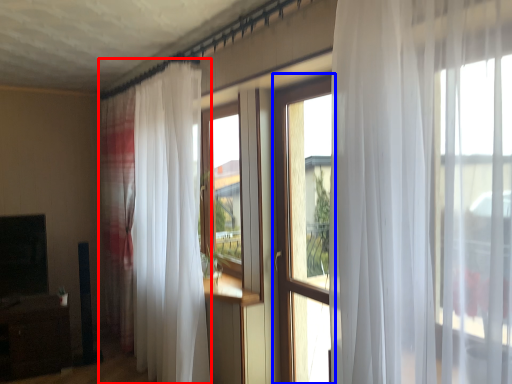
Question: Among these objects, which one is farthest to the camera, curtain (highlighted by a red box) or window (highlighted by a blue box)?

Choices:
 (A) curtain
 (B) window

Answer: (A)